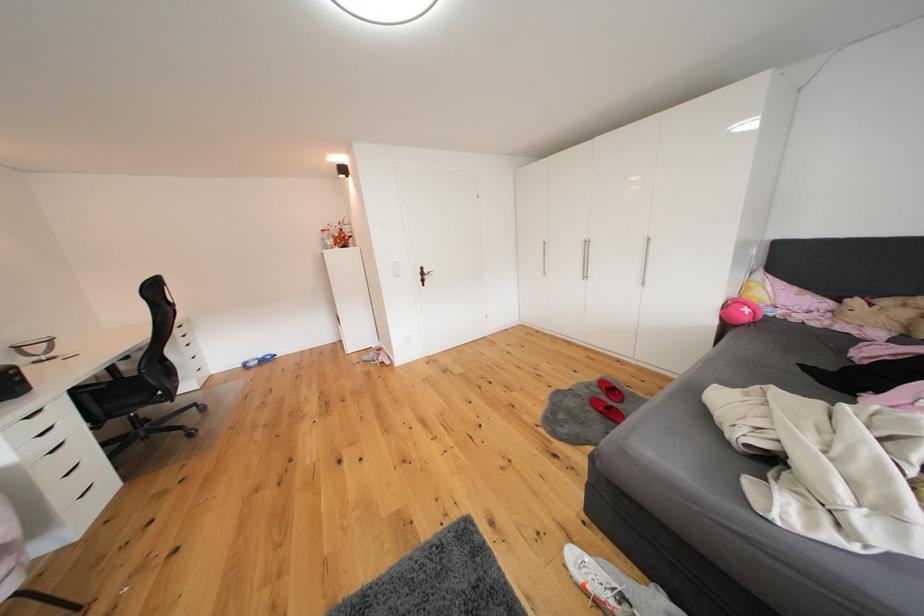
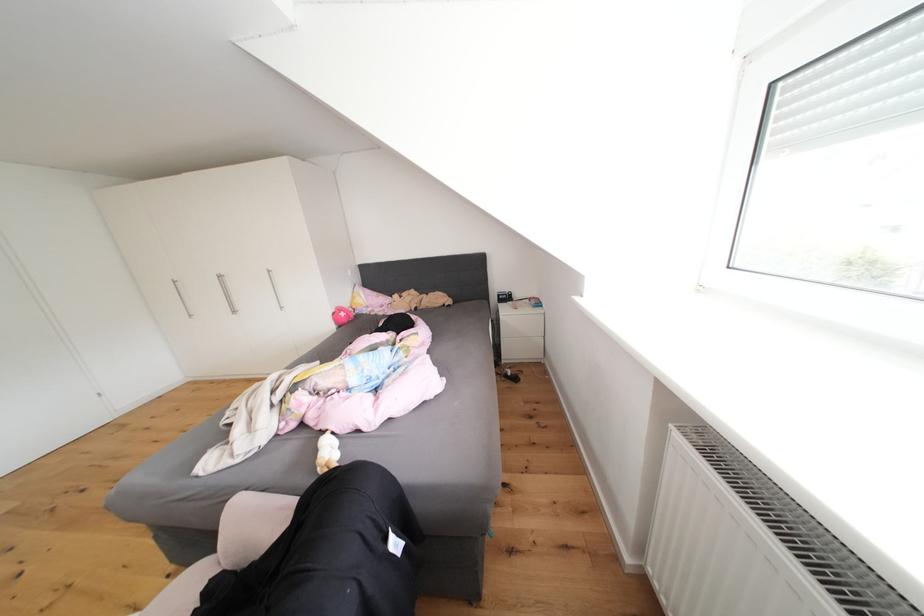
In the second image, find the point that corresponds to pixel 735 310 in the first image.

(343, 318)